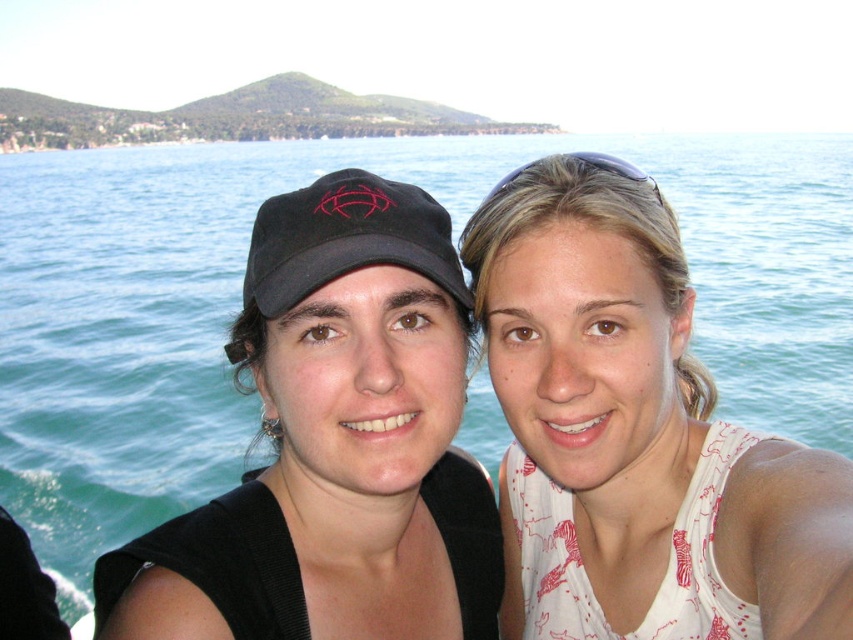
Which is more to the right, white printed tank top at center or black matte cap at center?

Positioned to the right is white printed tank top at center.

Between white printed tank top at center and black matte cap at center, which one is positioned higher?

white printed tank top at center is above.

Which is in front, point (548, 248) or point (412, 234)?

Point (548, 248) is more forward.

The width and height of the screenshot is (853, 640). Identify the location of white printed tank top at center. (635, 433).

Who is positioned more to the left, white printed tank top at center or black fabric baseball cap at center?

black fabric baseball cap at center

Consider the image. Is white printed tank top at center smaller than black fabric baseball cap at center?

No, white printed tank top at center is not smaller than black fabric baseball cap at center.

You are a GUI agent. You are given a task and a screenshot of the screen. Output one action in this format:
    pyautogui.click(x=<x>, y=<y>)
    Task: Click on the white printed tank top at center
    
    Given the screenshot: What is the action you would take?
    pyautogui.click(x=635, y=433)

Can you confirm if black matte cap at center is positioned to the right of black fabric baseball cap at center?

Correct, you'll find black matte cap at center to the right of black fabric baseball cap at center.

Who is positioned more to the right, black matte cap at center or black fabric baseball cap at center?

Positioned to the right is black matte cap at center.

Which is in front, point (390, 396) or point (338, 172)?

Point (338, 172) is in front.

Identify the location of black matte cap at center. The width and height of the screenshot is (853, 640). (335, 444).